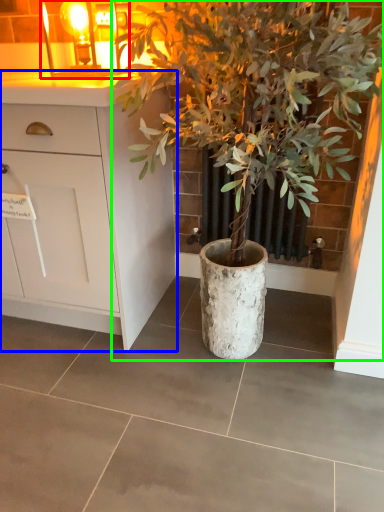
Question: Estimate the real-world distances between objects in this image. Which object is farther from light fixture (highlighted by a red box), cabinetry (highlighted by a blue box) or houseplant (highlighted by a green box)?

Choices:
 (A) cabinetry
 (B) houseplant

Answer: (B)